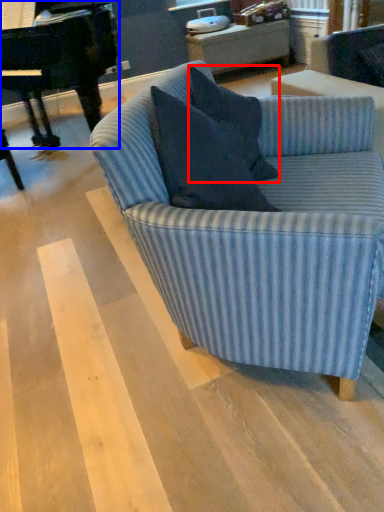
Question: Which of the following is the closest to the observer, pillow (highlighted by a red box) or piano (highlighted by a blue box)?

Choices:
 (A) pillow
 (B) piano

Answer: (A)